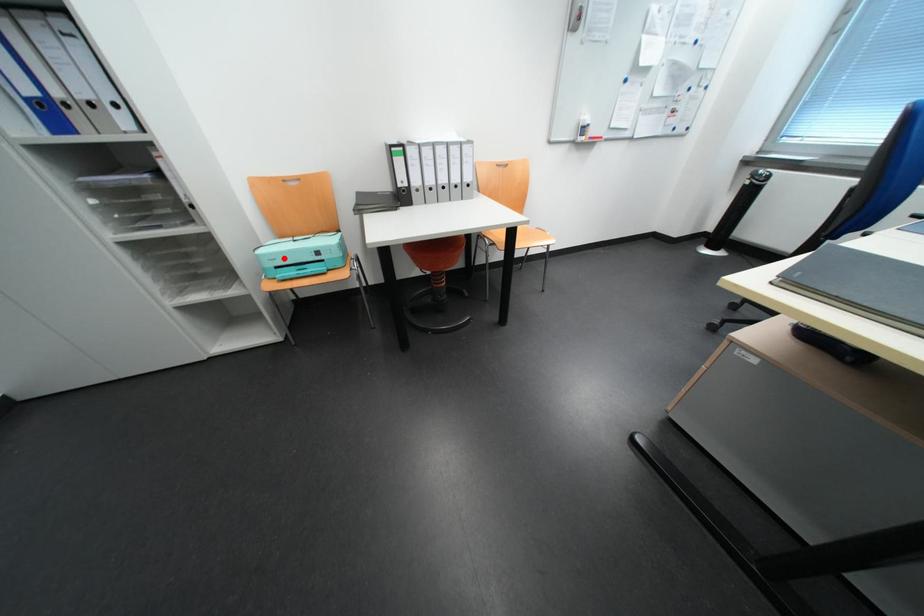
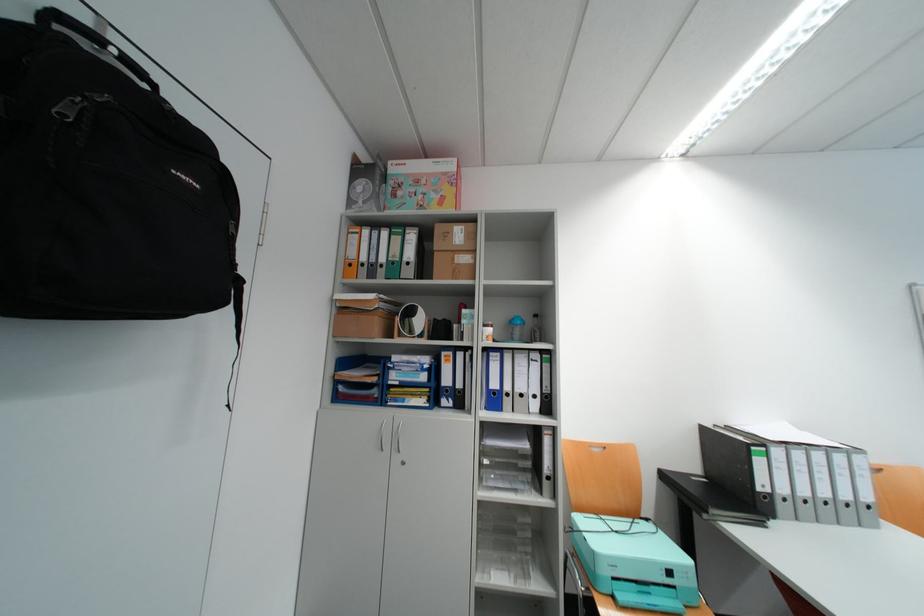
Locate, in the second image, the point that corresponds to the highlighted location in the first image.

(624, 562)